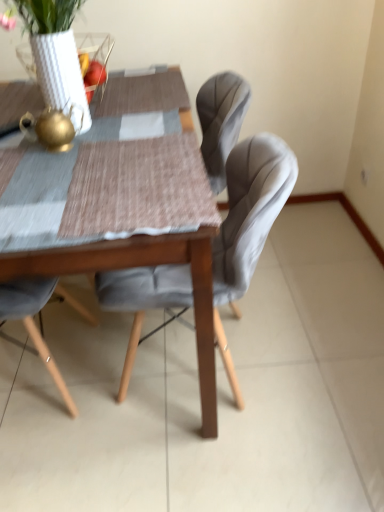
The width and height of the screenshot is (384, 512). I want to click on free location in front of white textured vase at upper left, so click(105, 192).